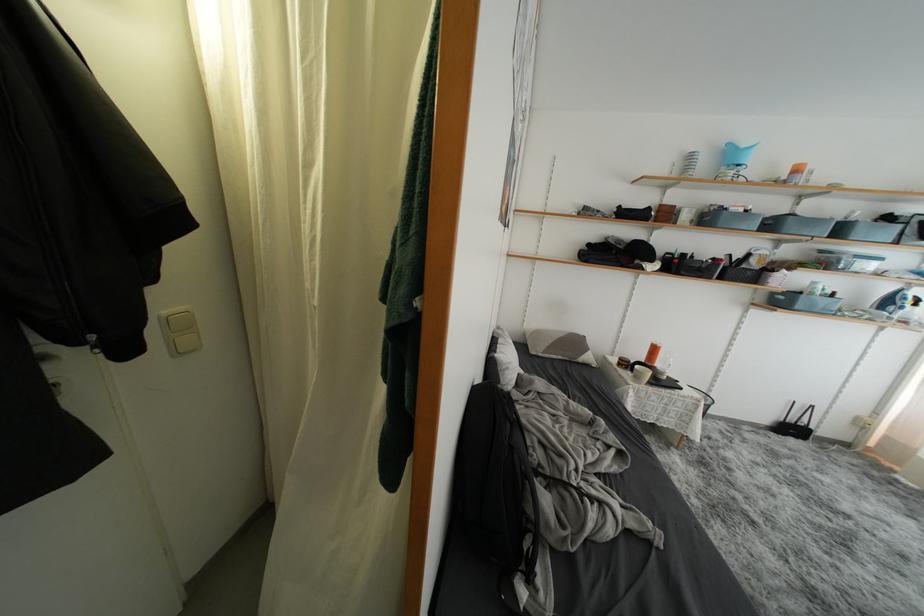
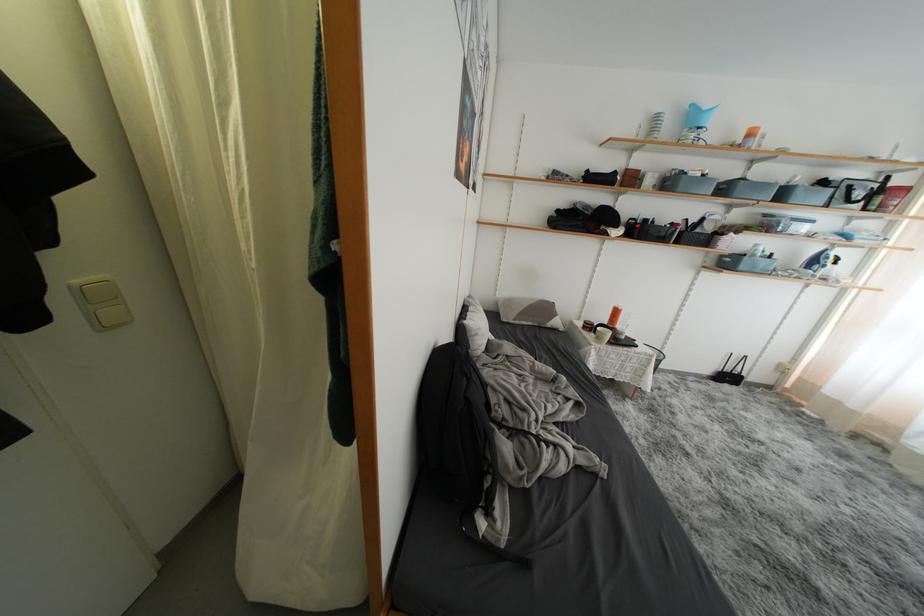
Question: Based on the continuous images, in which direction is the camera rotating? Reply with the corresponding letter.

Choices:
 (A) Left
 (B) Right
 (C) Up
 (D) Down

Answer: (D)